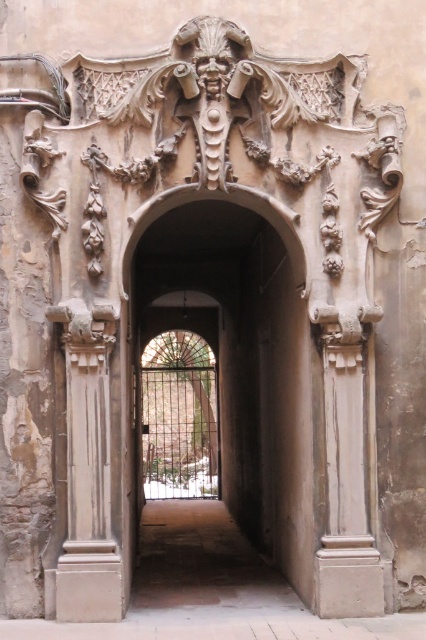
Question: Is smooth stone archway at center above smooth stone column at right?

Choices:
 (A) yes
 (B) no

Answer: (A)

Question: Which object is farther from the camera taking this photo?

Choices:
 (A) smooth stone archway at center
 (B) smooth stone column at right
 (C) beige stone column at left

Answer: (A)

Question: Which point is closer to the camera taking this photo?

Choices:
 (A) (78, 506)
 (B) (339, 344)
 (C) (198, 218)

Answer: (A)

Question: Is smooth stone archway at center wider than beige stone column at left?

Choices:
 (A) no
 (B) yes

Answer: (B)

Question: Does smooth stone archway at center have a greater width compared to beige stone column at left?

Choices:
 (A) no
 (B) yes

Answer: (B)

Question: Among these points, which one is farthest from the camera?

Choices:
 (A) (368, 392)
 (B) (161, 240)

Answer: (B)